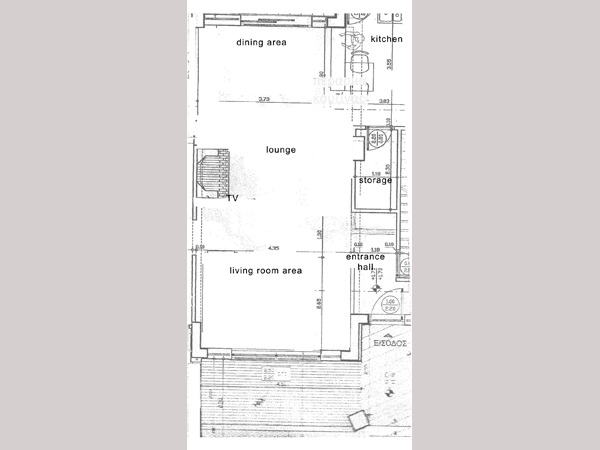
Identify the location of storage. (374, 178).